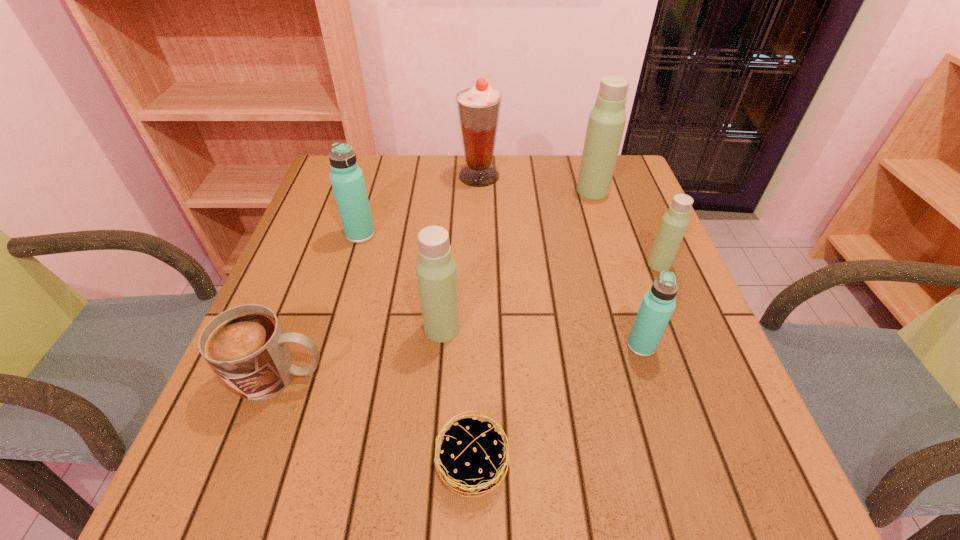
Where is `light thermos bottle that is the closest to the second shortest object`? The width and height of the screenshot is (960, 540). light thermos bottle that is the closest to the second shortest object is located at coordinates (436, 270).

At what (x,y) coordinates should I click in order to perform the action: click on free spot that satisfies the following two spatial constraints: 1. on the front side of the second light thermos bottle from left to right; 2. on the left side of the rightmost object. Please return your answer as a coordinate pair (x, y). Image resolution: width=960 pixels, height=540 pixels. Looking at the image, I should click on click(x=615, y=264).

The height and width of the screenshot is (540, 960). Find the location of `vacant region that satisfies the following two spatial constraints: 1. on the back side of the second light thermos bottle from left to right; 2. on the right side of the leftmost light thermos bottle`. vacant region that satisfies the following two spatial constraints: 1. on the back side of the second light thermos bottle from left to right; 2. on the right side of the leftmost light thermos bottle is located at coordinates (452, 191).

The width and height of the screenshot is (960, 540). In order to click on free space in the image that satisfies the following two spatial constraints: 1. on the back side of the farthest thermos bottle; 2. on the left side of the nearest light thermos bottle in this screenshot , I will do [x=452, y=191].